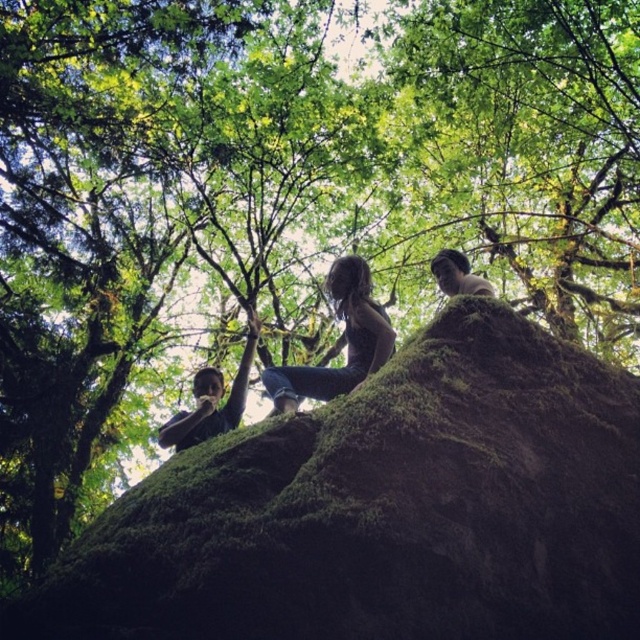
Question: Which object is positioned closest to the green mossy rock at center?

Choices:
 (A) dark brown leather jacket at center
 (B) denim jeans at center
 (C) smooth brown hair at upper right

Answer: (B)

Question: Which object appears farthest from the camera in this image?

Choices:
 (A) dark brown leather jacket at center
 (B) denim jeans at center

Answer: (A)

Question: Which object is closer to the camera taking this photo?

Choices:
 (A) smooth brown hair at upper right
 (B) denim jeans at center
 (C) green mossy rock at center
 (D) dark brown leather jacket at center

Answer: (C)

Question: Can you confirm if denim jeans at center is bigger than smooth brown hair at upper right?

Choices:
 (A) yes
 (B) no

Answer: (A)

Question: Can you confirm if dark brown leather jacket at center is bigger than smooth brown hair at upper right?

Choices:
 (A) yes
 (B) no

Answer: (A)

Question: Can you confirm if green mossy rock at center is wider than dark brown leather jacket at center?

Choices:
 (A) no
 (B) yes

Answer: (B)